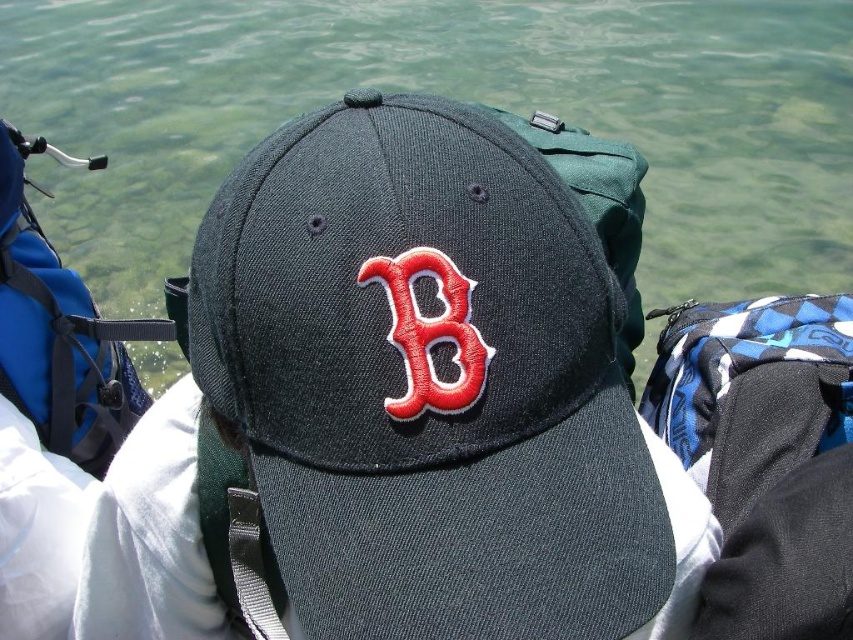
You are looking at the image and want to know which object is closer to you between the clear water at center and the red fabric letter b at center. Can you determine this based on their positions?

The clear water at center is closer to you than the red fabric letter b at center because it is positioned further away in the scene.